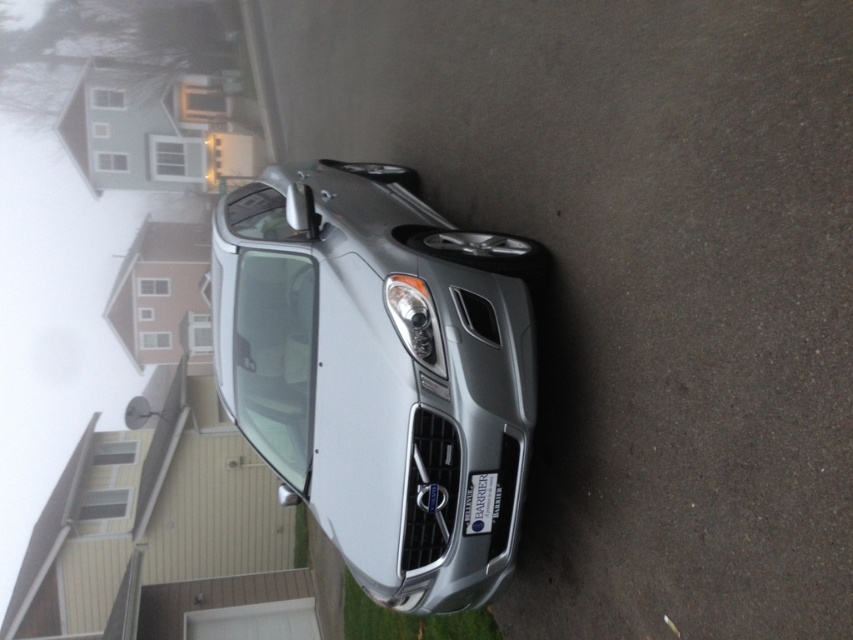
Question: In this image, where is satin silver car at center located relative to black plastic license plate at lower center?

Choices:
 (A) below
 (B) above

Answer: (B)

Question: Considering the real-world distances, which object is closest to the black plastic license plate at lower center?

Choices:
 (A) satin silver car at center
 (B) silver metallic car at center

Answer: (A)

Question: In this image, where is silver metallic car at center located relative to satin silver car at center?

Choices:
 (A) left
 (B) right

Answer: (B)

Question: Which point is farther to the camera?

Choices:
 (A) silver metallic car at center
 (B) black plastic license plate at lower center

Answer: (B)

Question: Considering the real-world distances, which object is farthest from the silver metallic car at center?

Choices:
 (A) satin silver car at center
 (B) black plastic license plate at lower center

Answer: (B)

Question: From the image, what is the correct spatial relationship of silver metallic car at center in relation to satin silver car at center?

Choices:
 (A) below
 (B) above

Answer: (B)